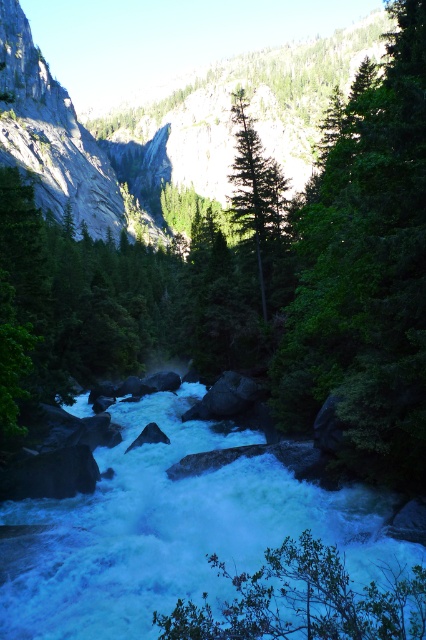
Question: Among these objects, which one is nearest to the camera?

Choices:
 (A) rough granite mountain at center
 (B) green leafy tree at lower center
 (C) white frothy water at center

Answer: (B)

Question: Which point appears closest to the camera in this image?

Choices:
 (A) (170, 464)
 (B) (333, 352)

Answer: (B)

Question: Can you confirm if rough granite mountain at center is bigger than green matte tree at center?

Choices:
 (A) no
 (B) yes

Answer: (B)

Question: Is green leafy tree at lower center bigger than green matte tree at center?

Choices:
 (A) yes
 (B) no

Answer: (B)

Question: Considering the relative positions of rough granite mountain at center and green matte tree at center in the image provided, where is rough granite mountain at center located with respect to green matte tree at center?

Choices:
 (A) left
 (B) right

Answer: (A)

Question: Which point is farther to the camera?

Choices:
 (A) white frothy water at center
 (B) green matte tree at center
 (C) green leafy tree at lower center

Answer: (B)